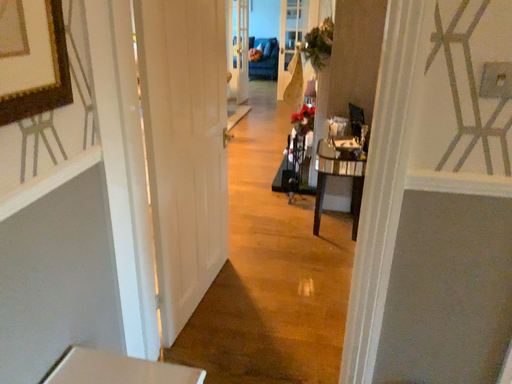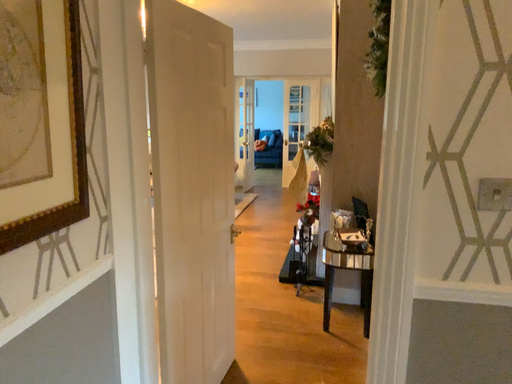
Question: How did the camera likely rotate when shooting the video?

Choices:
 (A) rotated downward
 (B) rotated upward

Answer: (B)